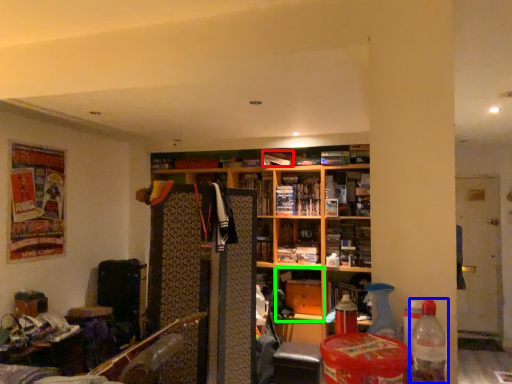
Question: Which is nearer to the book (highlighted by a red box)? bottle (highlighted by a blue box) or cabinet (highlighted by a green box).

Choices:
 (A) bottle
 (B) cabinet

Answer: (B)